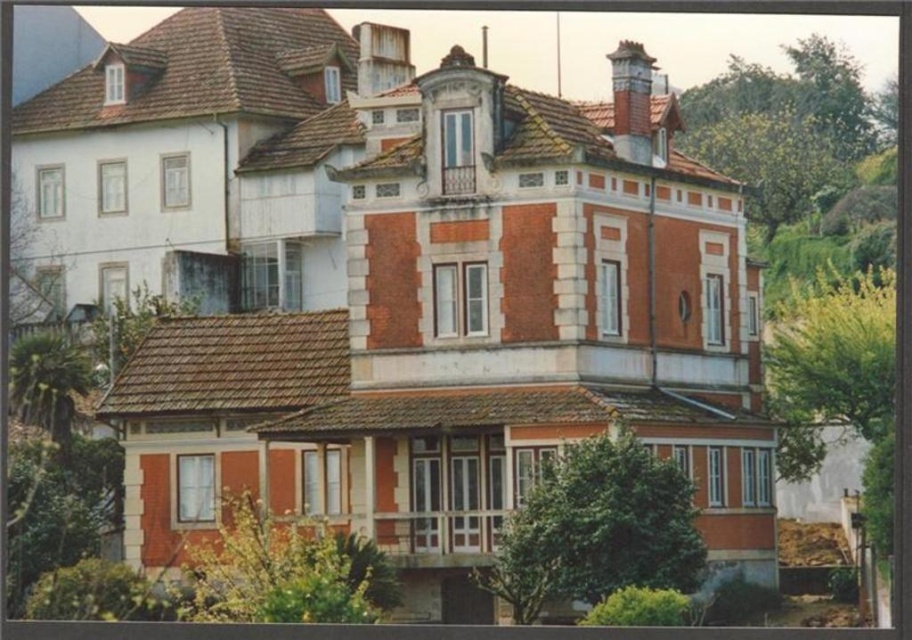
Question: Does green leafy tree at center appear on the left side of green leafy tree at upper right?

Choices:
 (A) yes
 (B) no

Answer: (A)

Question: Which object is closer to the camera taking this photo?

Choices:
 (A) green leafy tree at upper right
 (B) green leafy bush at lower left

Answer: (B)

Question: Considering the relative positions of green leafy tree at center and green leafy tree at upper left in the image provided, where is green leafy tree at center located with respect to green leafy tree at upper left?

Choices:
 (A) right
 (B) left

Answer: (A)

Question: Among these objects, which one is nearest to the camera?

Choices:
 (A) green leafy tree at center
 (B) green leafy bush at lower left
 (C) green leafy tree at upper left

Answer: (B)

Question: Among these objects, which one is nearest to the camera?

Choices:
 (A) green leafy tree at center
 (B) green leafy bush at lower left

Answer: (B)

Question: Is green leafy bush at lower left to the left of green leafy tree at upper left from the viewer's perspective?

Choices:
 (A) no
 (B) yes

Answer: (A)